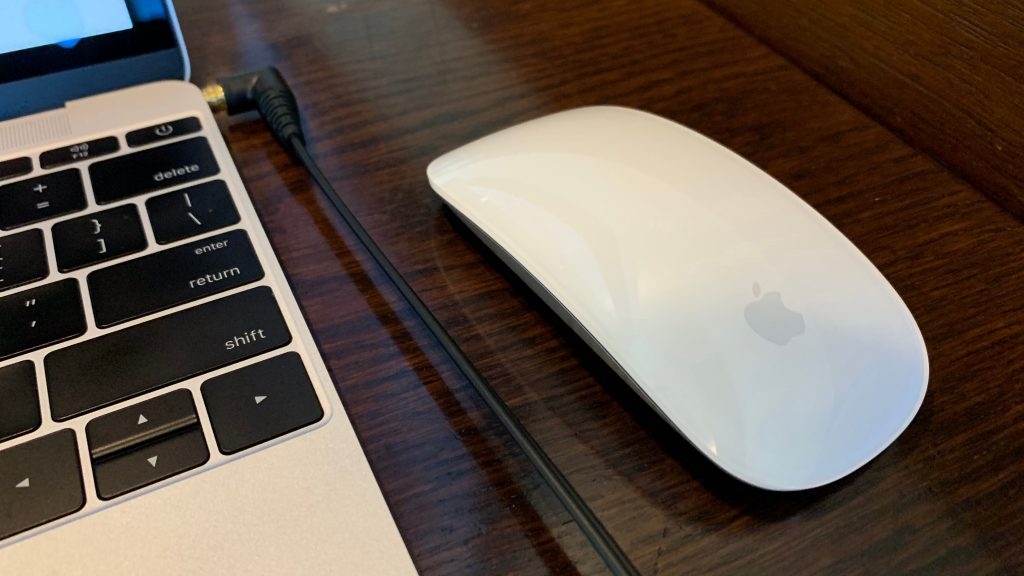
Find the location of a particular element. This screenshot has width=1024, height=576. power cord is located at coordinates (455, 353).